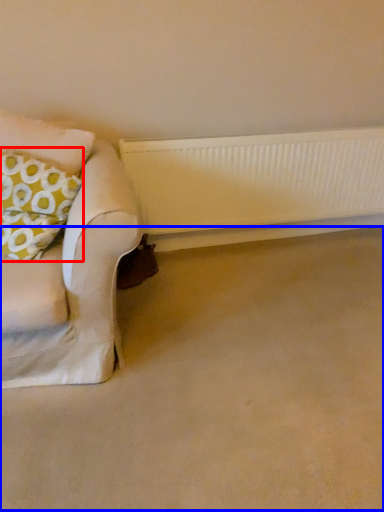
Question: Which object is closer to the camera taking this photo, throw pillow (highlighted by a red box) or plain (highlighted by a blue box)?

Choices:
 (A) throw pillow
 (B) plain

Answer: (B)